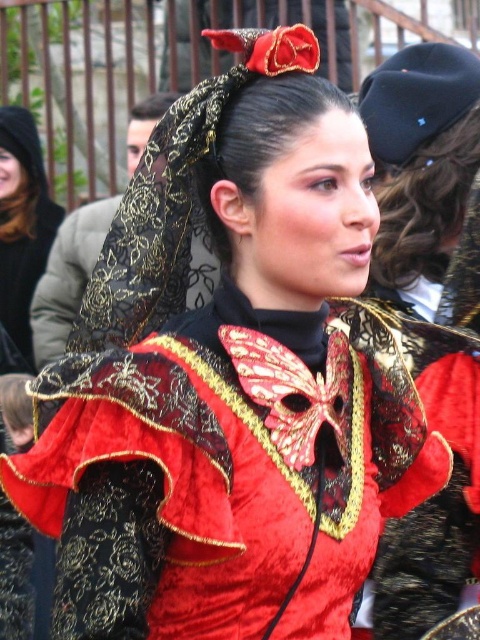
Does black lace veil at upper center have a greater width compared to matte black veil at upper left?

Yes.

Can you confirm if black lace veil at upper center is taller than matte black veil at upper left?

Correct, black lace veil at upper center is much taller as matte black veil at upper left.

Who is more distant from viewer, (166, 131) or (0, 220)?

Positioned behind is point (0, 220).

Locate an element on the screen. This screenshot has width=480, height=640. black lace veil at upper center is located at coordinates (173, 196).